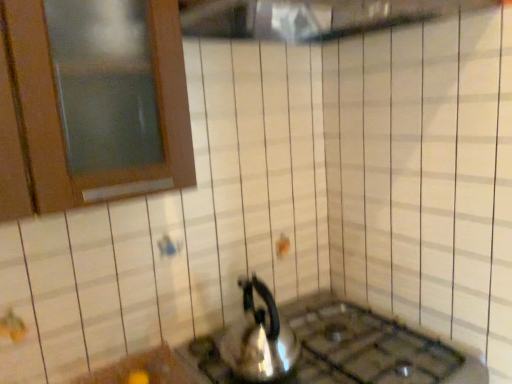
You are a GUI agent. You are given a task and a screenshot of the screen. Output one action in this format:
    pyautogui.click(x=<x>, y=<y>)
    Task: Click on the sleek metallic kettle at center
    Image resolution: width=512 pixels, height=384 pixels.
    Given the screenshot: What is the action you would take?
    pyautogui.click(x=259, y=338)

Image resolution: width=512 pixels, height=384 pixels. What do you see at coordinates (259, 338) in the screenshot?
I see `sleek metallic kettle at center` at bounding box center [259, 338].

What do you see at coordinates (369, 348) in the screenshot?
I see `satin silver gas stove at lower center` at bounding box center [369, 348].

Measure the distance between satin silver gas stove at lower center and camera.

They are 1.05 meters apart.

Locate an element on the screen. satin silver gas stove at lower center is located at coordinates (369, 348).

Image resolution: width=512 pixels, height=384 pixels. I want to click on sleek metallic kettle at center, so click(259, 338).

Which is more to the right, sleek metallic kettle at center or satin silver gas stove at lower center?

satin silver gas stove at lower center is more to the right.

Considering the positions of objects sleek metallic kettle at center and satin silver gas stove at lower center in the image provided, who is behind, sleek metallic kettle at center or satin silver gas stove at lower center?

sleek metallic kettle at center is further from the camera.

Does point (281, 330) appear closer or farther from the camera than point (215, 331)?

Point (281, 330) is farther from the camera than point (215, 331).

From the image's perspective, would you say sleek metallic kettle at center is shown under satin silver gas stove at lower center?

No, from the image's perspective, sleek metallic kettle at center is not beneath satin silver gas stove at lower center.

From a real-world perspective, is sleek metallic kettle at center beneath satin silver gas stove at lower center?

No, from a real-world perspective, sleek metallic kettle at center is not below satin silver gas stove at lower center.

Which object is thinner, sleek metallic kettle at center or satin silver gas stove at lower center?

Thinner between the two is sleek metallic kettle at center.

Considering the sizes of objects sleek metallic kettle at center and satin silver gas stove at lower center in the image provided, who is taller, sleek metallic kettle at center or satin silver gas stove at lower center?

Standing taller between the two is sleek metallic kettle at center.

Considering the sizes of objects sleek metallic kettle at center and satin silver gas stove at lower center in the image provided, who is smaller, sleek metallic kettle at center or satin silver gas stove at lower center?

sleek metallic kettle at center is smaller.

Is sleek metallic kettle at center outside of satin silver gas stove at lower center?

That's correct, sleek metallic kettle at center is outside of satin silver gas stove at lower center.

Is sleek metallic kettle at center far away from satin silver gas stove at lower center?

No, there isn't a large distance between sleek metallic kettle at center and satin silver gas stove at lower center.

Looking at this image, could you tell me if sleek metallic kettle at center is facing satin silver gas stove at lower center?

No, sleek metallic kettle at center is not aimed at satin silver gas stove at lower center.

The image size is (512, 384). I want to click on kettle that appears above the satin silver gas stove at lower center (from the image's perspective), so click(x=259, y=338).

Does satin silver gas stove at lower center appear on the left side of sleek metallic kettle at center?

No, satin silver gas stove at lower center is not to the left of sleek metallic kettle at center.

Relative to sleek metallic kettle at center, is satin silver gas stove at lower center in front or behind?

satin silver gas stove at lower center is positioned closer to the viewer than sleek metallic kettle at center.

Which is in front, point (311, 356) or point (259, 315)?

The point (259, 315) is closer to the camera.

From the image's perspective, between satin silver gas stove at lower center and sleek metallic kettle at center, which one is located above?

sleek metallic kettle at center.

From a real-world perspective, relative to sleek metallic kettle at center, is satin silver gas stove at lower center vertically above or below?

Clearly, from a real-world perspective, satin silver gas stove at lower center is below sleek metallic kettle at center.

Considering the sizes of satin silver gas stove at lower center and sleek metallic kettle at center in the image, is satin silver gas stove at lower center wider or thinner than sleek metallic kettle at center?

Clearly, satin silver gas stove at lower center has more width compared to sleek metallic kettle at center.

Considering the sizes of objects satin silver gas stove at lower center and sleek metallic kettle at center in the image provided, who is taller, satin silver gas stove at lower center or sleek metallic kettle at center?

sleek metallic kettle at center.

Looking at this image, which of these two, satin silver gas stove at lower center or sleek metallic kettle at center, is smaller?

Smaller between the two is sleek metallic kettle at center.

Is satin silver gas stove at lower center not inside sleek metallic kettle at center?

That's correct, satin silver gas stove at lower center is outside of sleek metallic kettle at center.

Is the surface of satin silver gas stove at lower center in direct contact with sleek metallic kettle at center?

No, satin silver gas stove at lower center is not with sleek metallic kettle at center.

Is satin silver gas stove at lower center turned away from sleek metallic kettle at center?

No, sleek metallic kettle at center is not at the back of satin silver gas stove at lower center.

What's the angular difference between satin silver gas stove at lower center and sleek metallic kettle at center's facing directions?

The facing directions of satin silver gas stove at lower center and sleek metallic kettle at center are 0.112 degrees apart.

How distant is satin silver gas stove at lower center from sleek metallic kettle at center?

satin silver gas stove at lower center and sleek metallic kettle at center are 5.38 inches apart from each other.

The height and width of the screenshot is (384, 512). I want to click on kettle on the left of satin silver gas stove at lower center, so click(x=259, y=338).

Locate an element on the screen. The height and width of the screenshot is (384, 512). kettle above the satin silver gas stove at lower center (from the image's perspective) is located at coordinates (259, 338).

Where is `kettle lying behind the satin silver gas stove at lower center`? This screenshot has height=384, width=512. kettle lying behind the satin silver gas stove at lower center is located at coordinates (259, 338).